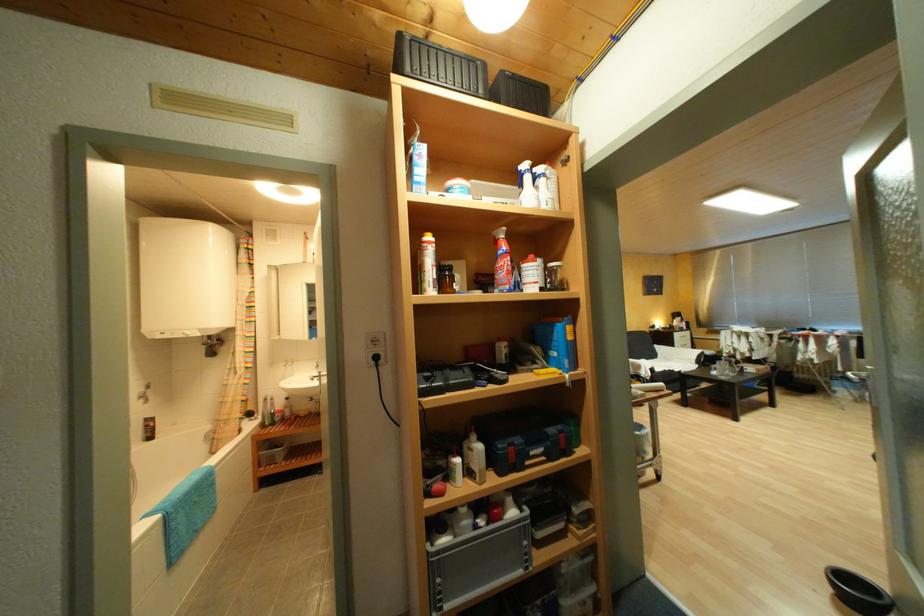
Where is `sink faucet handle`? sink faucet handle is located at coordinates point(317,373).